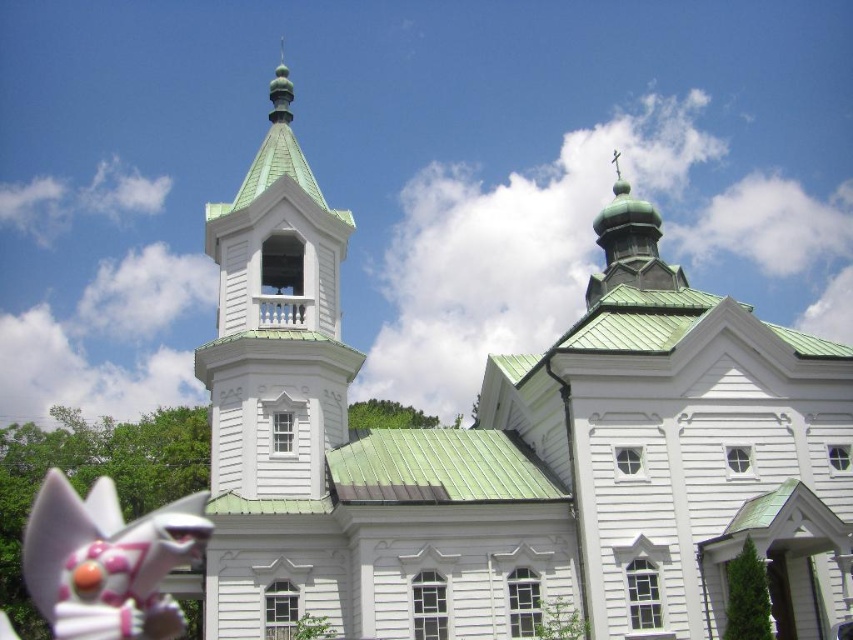
Does green matte bell tower at upper center come behind white glossy cat figurine at lower left?

Yes, green matte bell tower at upper center is behind white glossy cat figurine at lower left.

Which is in front, point (320, 237) or point (91, 582)?

Point (91, 582)

Locate an element on the screen. green matte bell tower at upper center is located at coordinates (276, 323).

Does green metallic church at upper left have a greater height compared to green matte bell tower at upper center?

In fact, green metallic church at upper left may be shorter than green matte bell tower at upper center.

Does green metallic church at upper left have a smaller size compared to green matte bell tower at upper center?

Incorrect, green metallic church at upper left is not smaller in size than green matte bell tower at upper center.

Does point (274, 164) come behind point (351, 224)?

Yes, it is behind point (351, 224).

Where is `green metallic church at upper left`? The height and width of the screenshot is (640, 853). green metallic church at upper left is located at coordinates (512, 449).

Does green metallic church at upper left have a lesser width compared to white glossy cat figurine at lower left?

No.

What do you see at coordinates (512, 449) in the screenshot? The height and width of the screenshot is (640, 853). I see `green metallic church at upper left` at bounding box center [512, 449].

What are the coordinates of `green metallic church at upper left` in the screenshot? It's located at (512, 449).